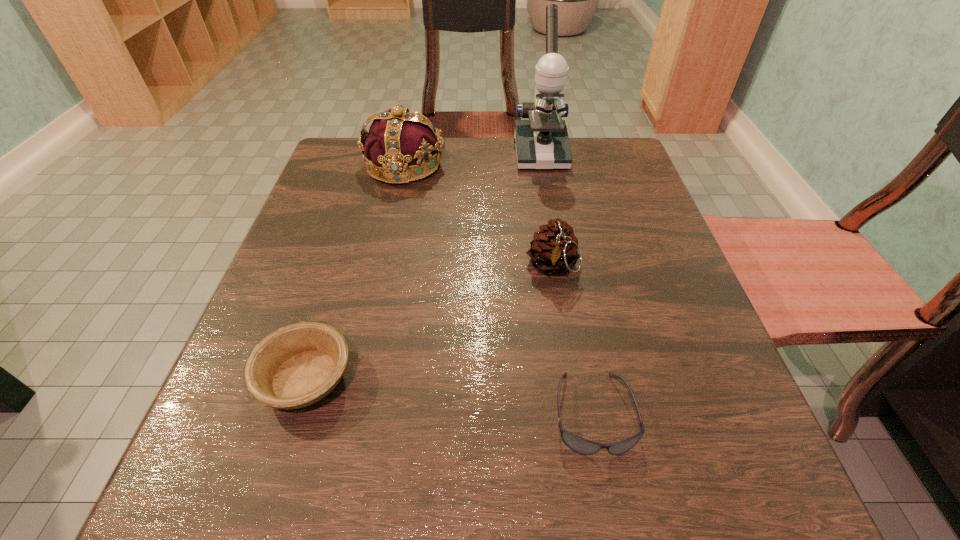
Where is `microscope located in the far edge section of the desktop`? This screenshot has height=540, width=960. microscope located in the far edge section of the desktop is located at coordinates (542, 142).

Locate an element on the screen. The width and height of the screenshot is (960, 540). crown present at the far edge is located at coordinates (398, 143).

Locate an element on the screen. This screenshot has height=540, width=960. object at the near edge is located at coordinates (578, 444).

Locate an element on the screen. The image size is (960, 540). crown that is at the left edge is located at coordinates (398, 143).

The height and width of the screenshot is (540, 960). I want to click on bowl that is at the left edge, so coord(297,365).

Where is `microscope at the right edge`? The image size is (960, 540). microscope at the right edge is located at coordinates (542, 142).

Locate an element on the screen. This screenshot has width=960, height=540. sunglasses located in the right edge section of the desktop is located at coordinates (578, 444).

This screenshot has height=540, width=960. I want to click on object at the far left corner, so click(398, 143).

Find the location of `object that is at the far right corner`. object that is at the far right corner is located at coordinates (542, 142).

The width and height of the screenshot is (960, 540). What are the coordinates of `object present at the near right corner` in the screenshot? It's located at (578, 444).